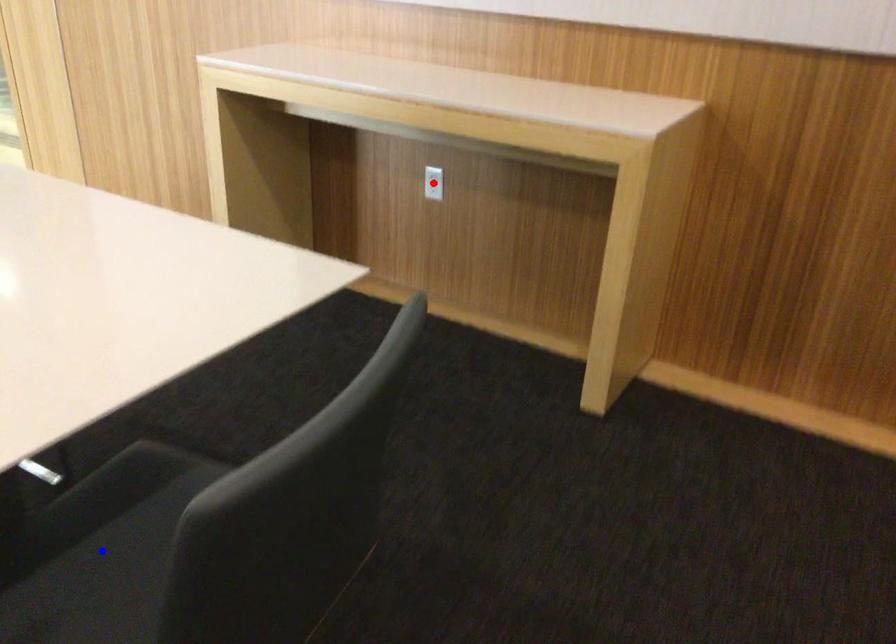
Question: Two points are marked on the image. Which point is closer to the camera?

Choices:
 (A) Blue point is closer.
 (B) Red point is closer.

Answer: (A)